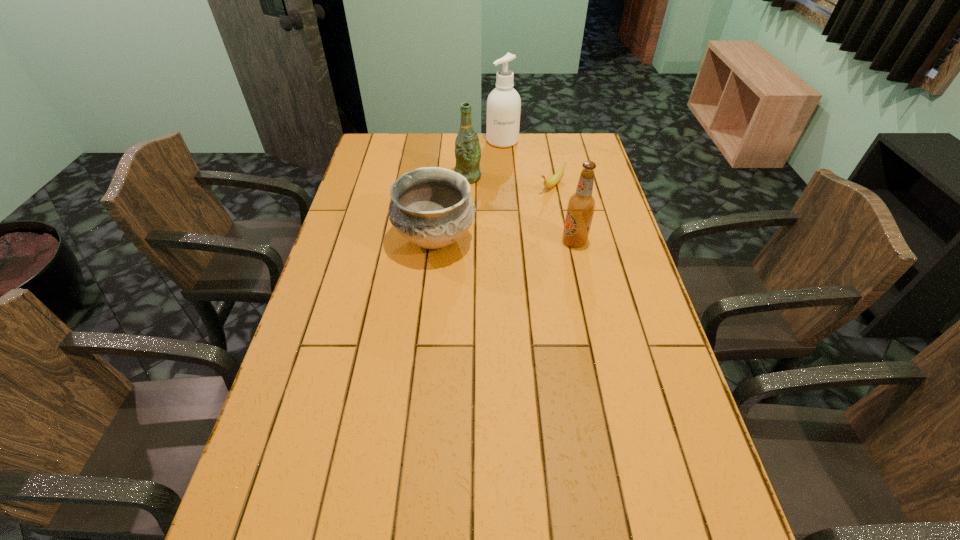
I want to click on vacant spot on the desktop that is between the fourth tallest object and the right beer bottle and is positioned on the surface of the farther beer bottle, so click(x=516, y=241).

Find the location of a particular element. vacant spot on the desktop that is between the second shortest object and the nearer beer bottle and is positioned on the front label of the tallest object is located at coordinates (519, 241).

What are the coordinates of `free spot on the desktop that is between the fourth tallest object and the nearer beer bottle and is positioned at the stem of the banana` in the screenshot? It's located at point(492,240).